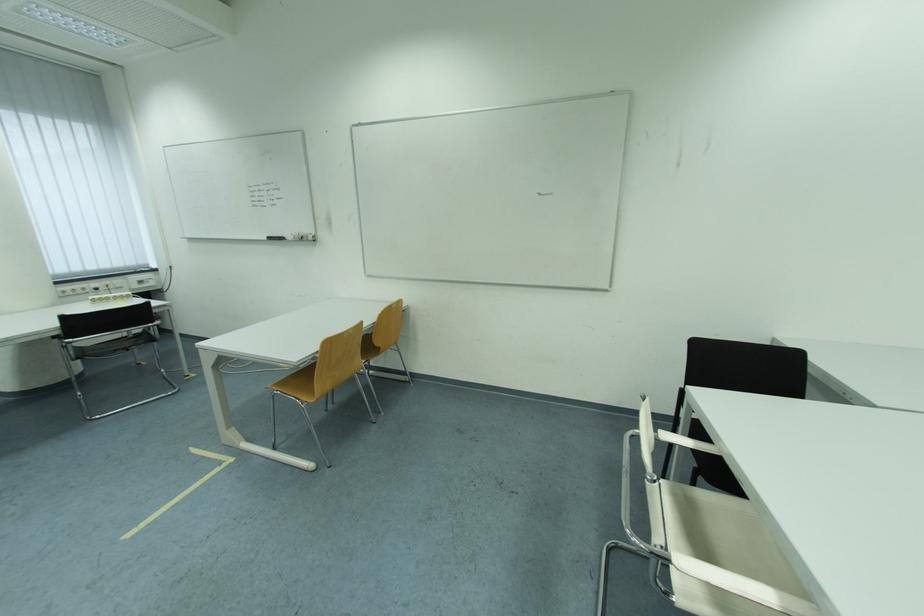
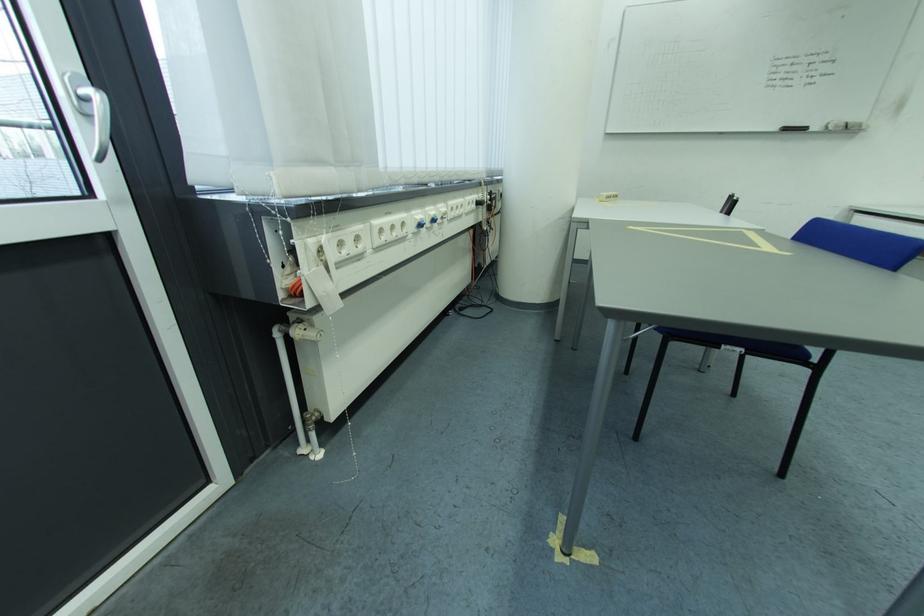
Where in the second image is the point corresponding to the point at 302,240 from the first image?

(845, 129)